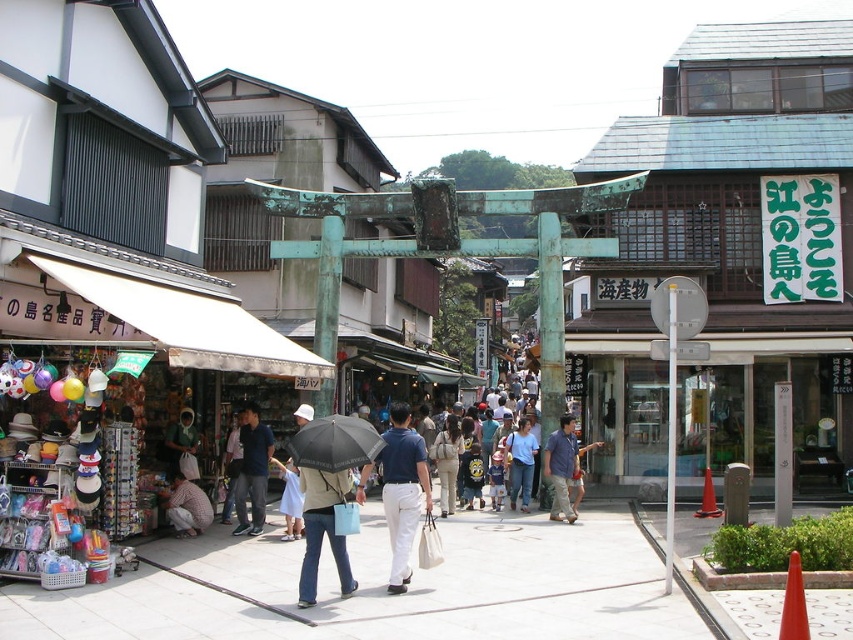
Does dark blue shirt at center appear over matte black shirt at center?

No, dark blue shirt at center is not above matte black shirt at center.

Does point (242, 492) come farther from viewer compared to point (172, 444)?

No.

Find the location of a particular element. dark blue shirt at center is located at coordinates (252, 472).

Locate an element on the screen. The height and width of the screenshot is (640, 853). blue cotton shirt at center is located at coordinates (561, 467).

Does blue cotton shirt at center have a larger size compared to matte black shirt at center?

Incorrect, blue cotton shirt at center is not larger than matte black shirt at center.

Is point (555, 474) positioned after point (181, 408)?

Yes, point (555, 474) is behind point (181, 408).

The image size is (853, 640). Identify the location of blue cotton shirt at center. (561, 467).

Does black matte umbrella at center come in front of matte black shirt at center?

Yes.

Is point (346, 449) in front of point (166, 468)?

Yes, point (346, 449) is closer to viewer.

Identify the location of black matte umbrella at center. This screenshot has width=853, height=640. (334, 444).